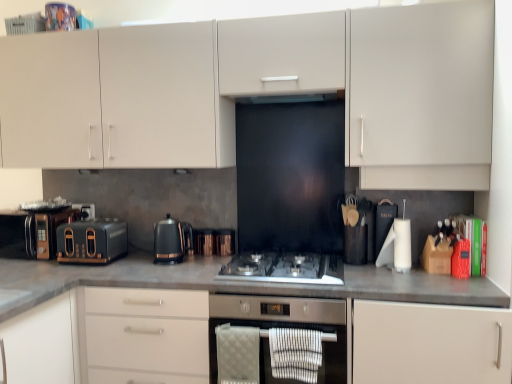
Find the location of a particular element. The width and height of the screenshot is (512, 384). free space between stainless steel gas stove at center and metallic copper kettle at center, the first appliance viewed from the right is located at coordinates (221, 259).